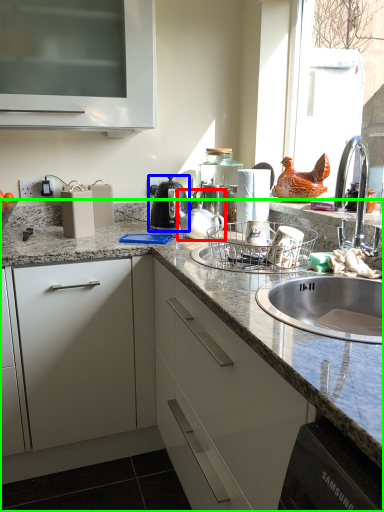
Question: Considering the real-world distances, which object is farthest from tea pot (highlighted by a red box)? coffeepot (highlighted by a blue box) or countertop (highlighted by a green box)?

Choices:
 (A) coffeepot
 (B) countertop

Answer: (B)